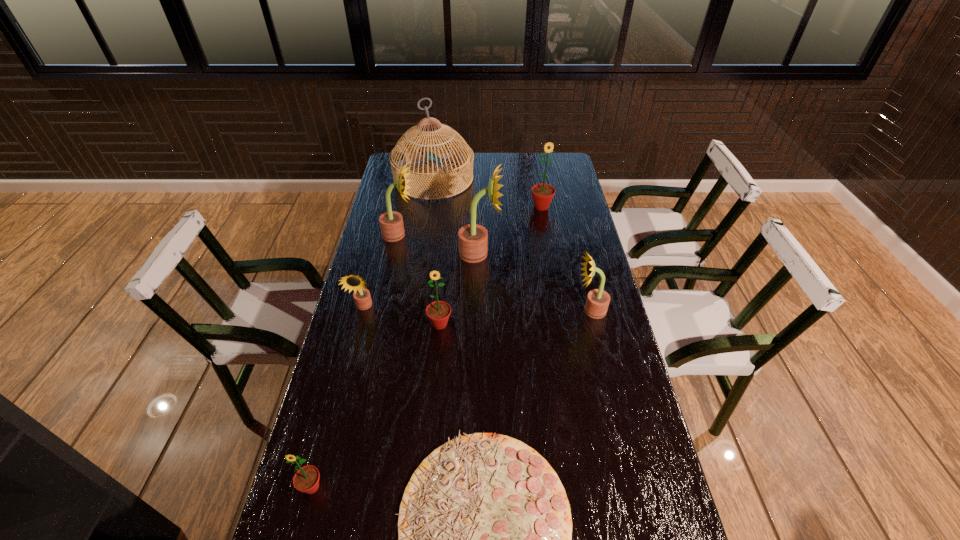
The image size is (960, 540). In order to click on object that can be found as the seventh closest to the nearest green sunflower in this screenshot , I will do `click(397, 158)`.

This screenshot has height=540, width=960. In order to click on sunflower that is the second closest one to the tallest sunflower in this screenshot , I will do pos(542,193).

Locate which sunflower ranks fourth in proximity to the smallest yellow sunflower. Please provide its 2D coordinates. Your answer should be formatted as a tuple, i.e. [(x, y)], where the tuple contains the x and y coordinates of a point satisfying the conditions above.

[(306, 479)]

Find the location of a particular element. The width and height of the screenshot is (960, 540). yellow sunflower that is the third closest to the shortest object is located at coordinates (473, 239).

You are a GUI agent. You are given a task and a screenshot of the screen. Output one action in this format:
    pyautogui.click(x=<x>, y=<y>)
    Task: Click on the yellow sunflower that is the third closest one to the smallest green sunflower
    This screenshot has height=540, width=960.
    Given the screenshot: What is the action you would take?
    pyautogui.click(x=598, y=300)

Choose which green sunflower is the nearest neighbor to the shortest object. Please provide its 2D coordinates. Your answer should be formatted as a tuple, i.e. [(x, y)], where the tuple contains the x and y coordinates of a point satisfying the conditions above.

[(306, 479)]

Find the location of a particular element. Image resolution: width=960 pixels, height=540 pixels. the second closest green sunflower to the third smallest yellow sunflower is located at coordinates (542, 193).

Identify the location of free spot that satisfies the following two spatial constraints: 1. on the face of the second yellow sunflower from right to left; 2. on the face of the smallest yellow sunflower. (480, 307).

Find the location of a particular element. The image size is (960, 540). vacant space that satisfies the following two spatial constraints: 1. on the face of the third sunflower from right to left; 2. on the face of the smallest yellow sunflower is located at coordinates (480, 307).

I want to click on free point that satisfies the following two spatial constraints: 1. on the face of the second smallest yellow sunflower; 2. on the face of the fourth sunflower from right to left, so [x=594, y=324].